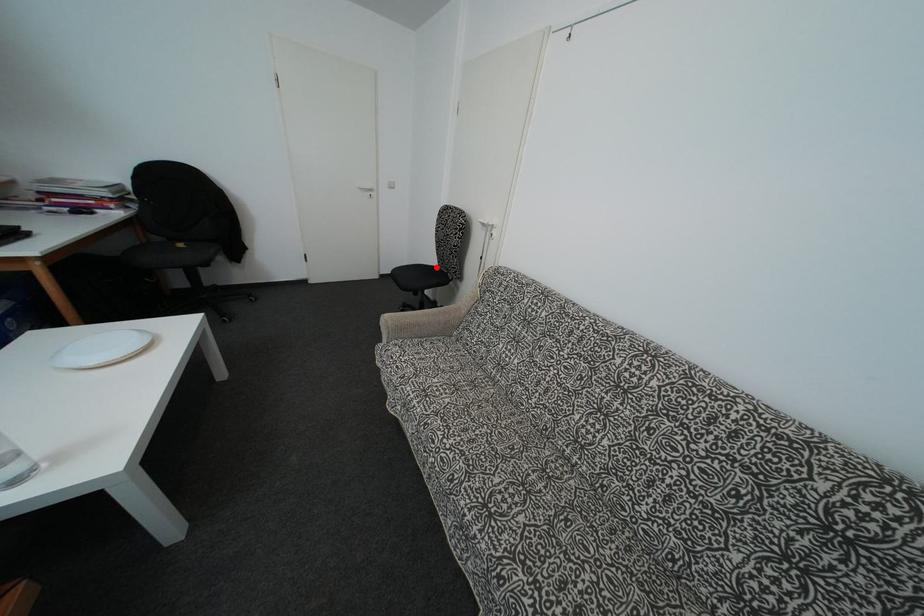
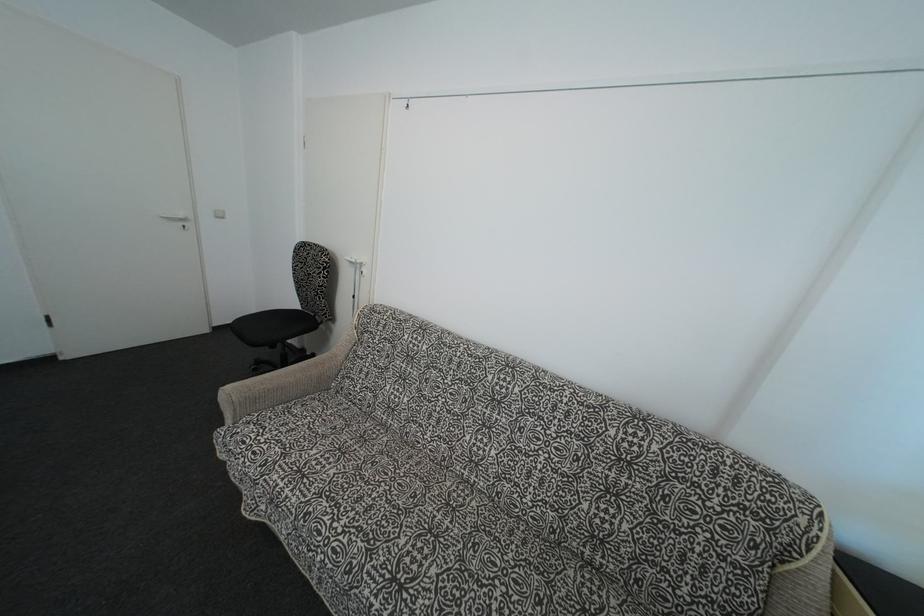
In the second image, find the point that corresponds to the highlighted location in the first image.

(297, 310)